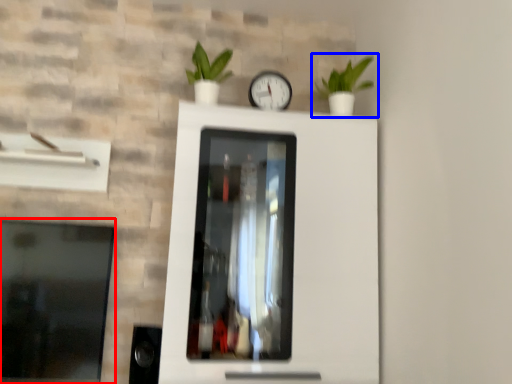
Question: Which object is further to the camera taking this photo, window (highlighted by a red box) or houseplant (highlighted by a blue box)?

Choices:
 (A) window
 (B) houseplant

Answer: (B)